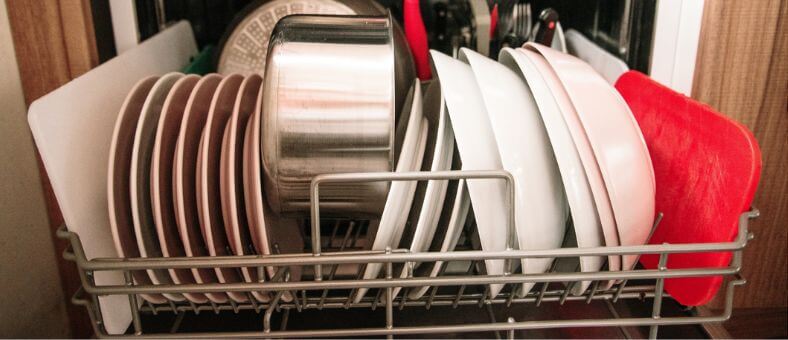
At what (x,y) coordinates should I click in order to perform the action: click on bowls in dishwasher. Please return your answer as a coordinate pair (x, y). The height and width of the screenshot is (340, 788). Looking at the image, I should click on (623, 157), (600, 204), (581, 221), (525, 163), (487, 160).